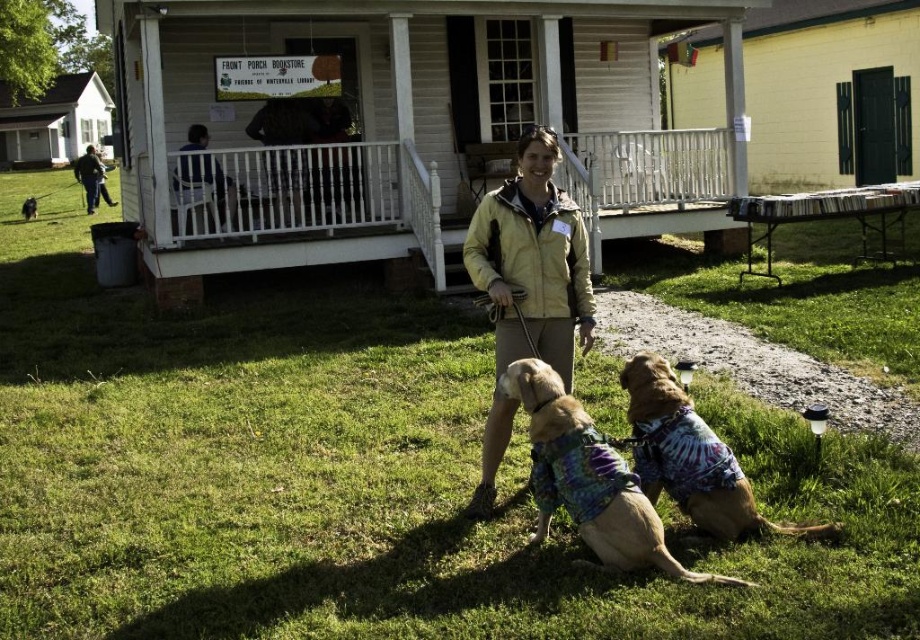
Does green grass at lower center come behind brown fur dog at lower center?

No, green grass at lower center is closer to the viewer.

Identify the location of green grass at lower center. This screenshot has width=920, height=640. (355, 476).

Image resolution: width=920 pixels, height=640 pixels. I want to click on green grass at lower center, so click(355, 476).

Image resolution: width=920 pixels, height=640 pixels. In order to click on green grass at lower center in this screenshot , I will do pos(355,476).

Between multicolored fabric dog at lower right and blue shirt at upper center, which one is positioned lower?

multicolored fabric dog at lower right is below.

Consider the image. Is multicolored fabric dog at lower right above blue shirt at upper center?

Actually, multicolored fabric dog at lower right is below blue shirt at upper center.

The image size is (920, 640). What do you see at coordinates (690, 456) in the screenshot? I see `multicolored fabric dog at lower right` at bounding box center [690, 456].

At what (x,y) coordinates should I click in order to perform the action: click on multicolored fabric dog at lower right. Please return your answer as a coordinate pair (x, y). The width and height of the screenshot is (920, 640). Looking at the image, I should click on (690, 456).

Does light yellow jacket at center come behind multicolored fabric dog at lower right?

Yes, it is behind multicolored fabric dog at lower right.

Is point (508, 406) positioned before point (640, 458)?

No, (508, 406) is behind (640, 458).

The height and width of the screenshot is (640, 920). I want to click on light yellow jacket at center, so click(x=532, y=260).